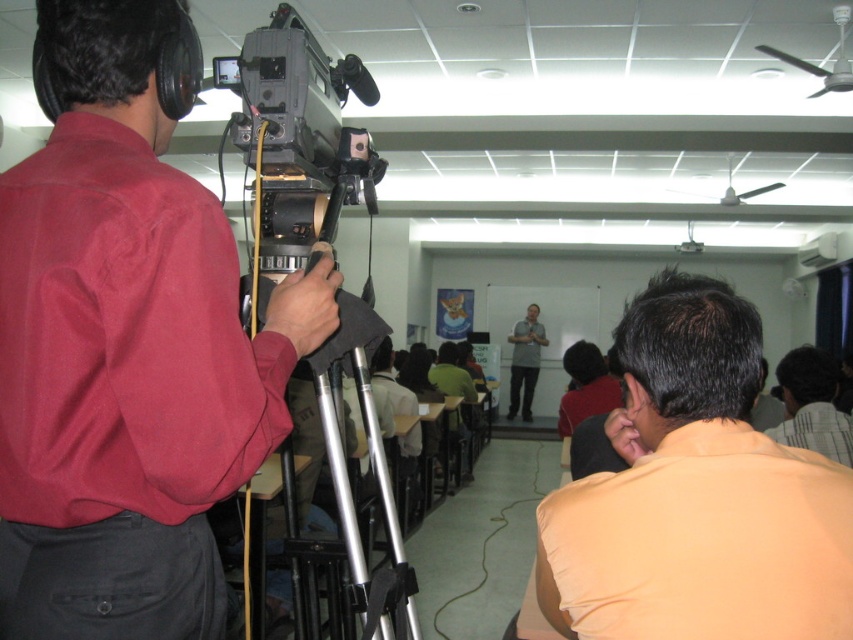
Based on the photo, does orange matte shirt at lower right appear under silver metallic tripod at center?

No, orange matte shirt at lower right is not below silver metallic tripod at center.

Who is positioned more to the right, orange matte shirt at lower right or silver metallic tripod at center?

Positioned to the right is orange matte shirt at lower right.

Is point (662, 602) closer to camera compared to point (328, 419)?

Yes, it is in front of point (328, 419).

Locate an element on the screen. The image size is (853, 640). orange matte shirt at lower right is located at coordinates (695, 496).

Between matte red shirt at left and gray fabric shirt at center, which one is positioned higher?

matte red shirt at left is above.

Who is more distant from viewer, (218, 388) or (531, 353)?

The point (531, 353) is behind.

You are a GUI agent. You are given a task and a screenshot of the screen. Output one action in this format:
    pyautogui.click(x=<x>, y=<y>)
    Task: Click on the matte red shirt at left
    
    Given the screenshot: What is the action you would take?
    pyautogui.click(x=126, y=353)

Identify the location of matte red shirt at left. The image size is (853, 640). (126, 353).

Does matte red shirt at left appear on the right side of orange matte shirt at lower right?

In fact, matte red shirt at left is to the left of orange matte shirt at lower right.

Is point (158, 193) less distant than point (712, 557)?

No, (158, 193) is further to viewer.

Locate an element on the screen. matte red shirt at left is located at coordinates tap(126, 353).